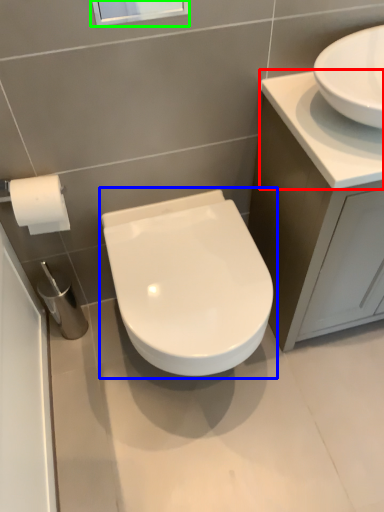
Question: Estimate the real-world distances between objects in this image. Which object is closer to counter top (highlighted by a red box), toilet (highlighted by a blue box) or window screen (highlighted by a green box)?

Choices:
 (A) toilet
 (B) window screen

Answer: (A)